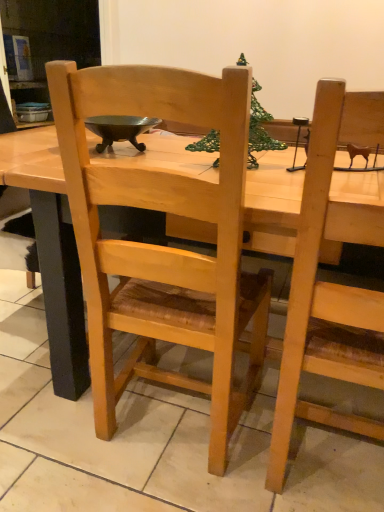
Identify the location of free spot to the left of natural wood chair at center. (45, 435).